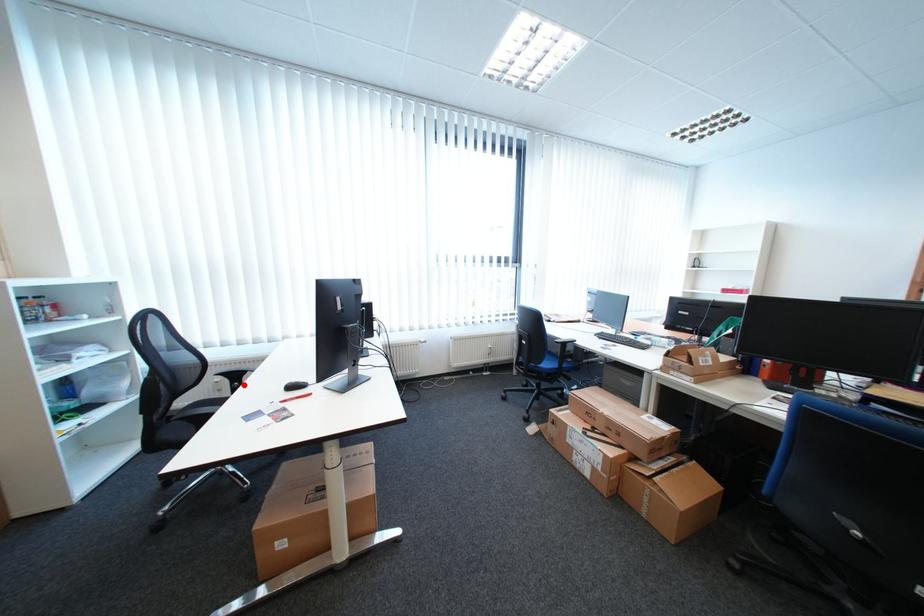
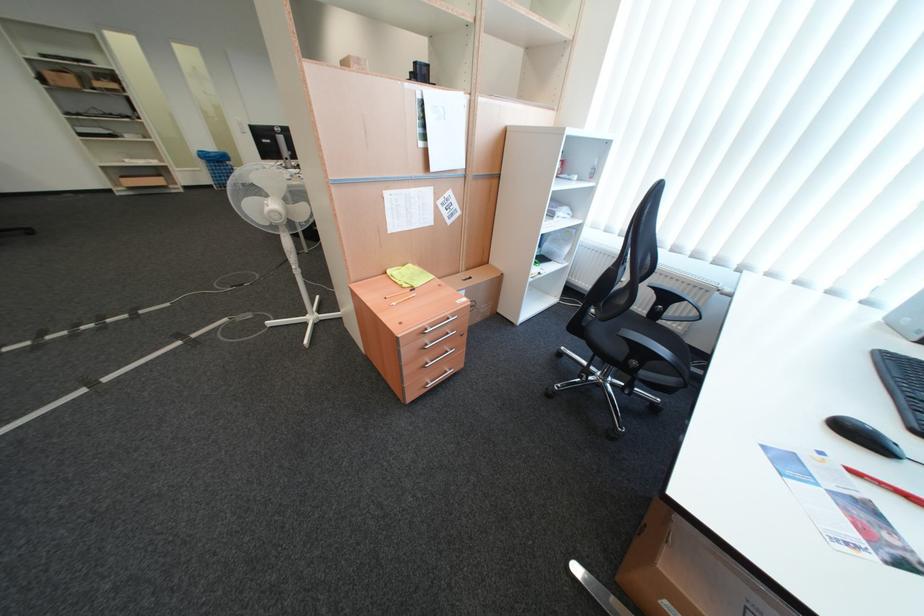
Find the pixel in the second image that matches the highlighted location in the first image.

(667, 305)